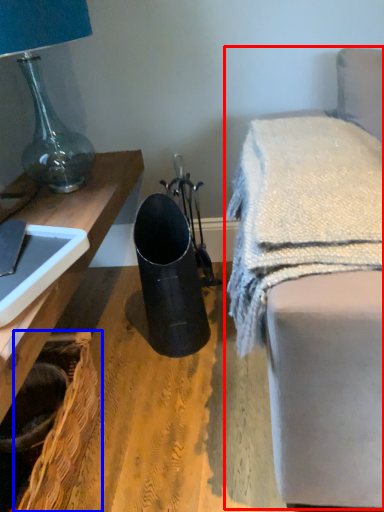
Question: Which object appears closest to the camera in this image, furniture (highlighted by a red box) or basket (highlighted by a blue box)?

Choices:
 (A) furniture
 (B) basket

Answer: (A)